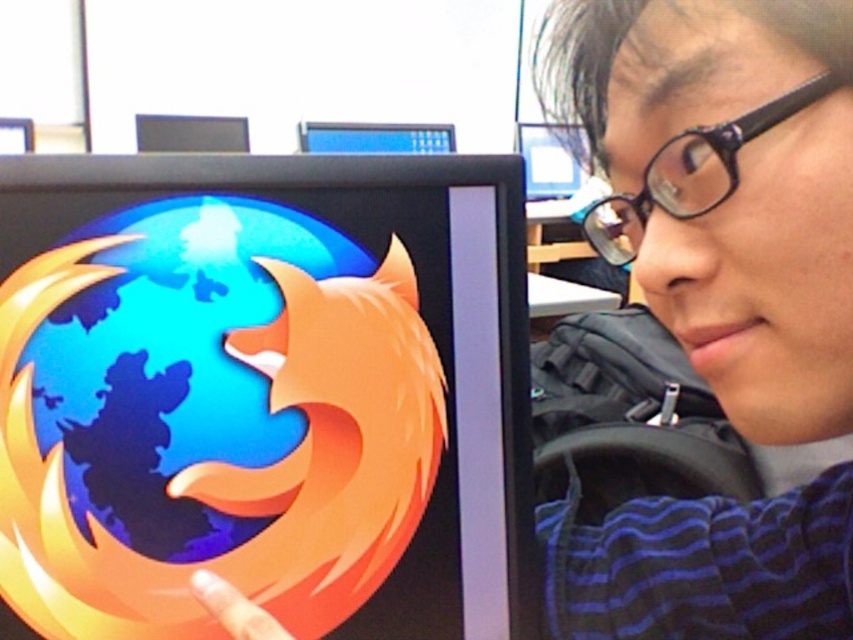
You are a technician trying to fix a monitor issue. You see the blue glossy monitor at upper center and the glossy plastic finger at lower left. Which object is closer to you in the image?

The glossy plastic finger at lower left is behind the blue glossy monitor at upper center, so the blue glossy monitor at upper center is closer to you.

You are a technician in an office. You need to check if the glossy plastic finger at lower left can reach the blue glossy monitor at upper center. Based on their positions, can the finger reach the monitor?

The blue glossy monitor at upper center is to the left of the glossy plastic finger at lower left, so the finger cannot reach the monitor since it is positioned to the left of the finger.